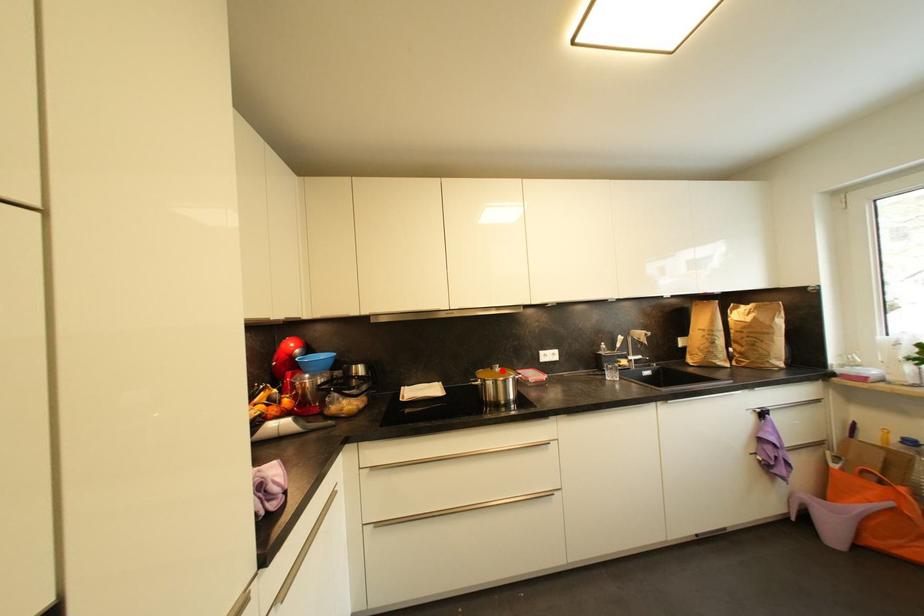
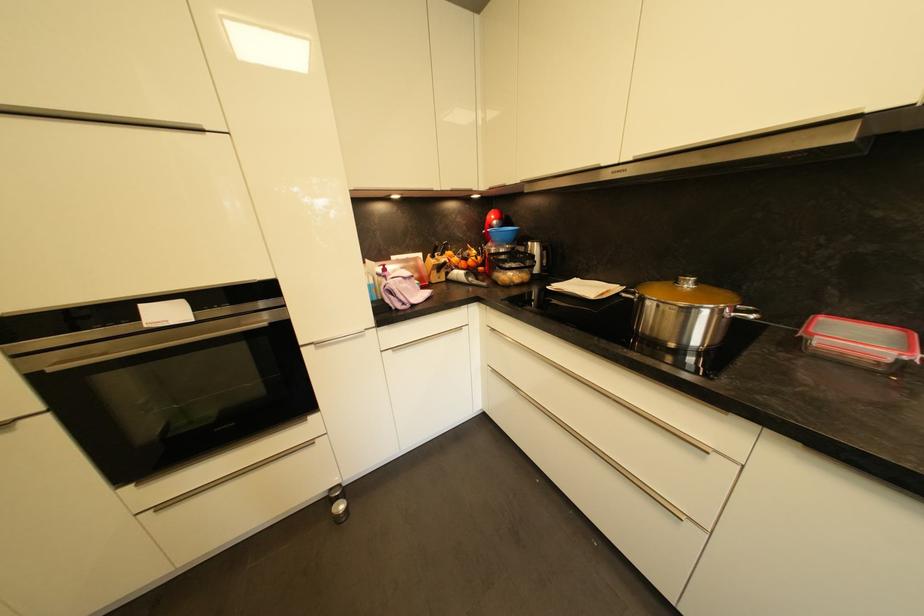
Where in the second image is the point corresponding to the highlighted location from the first image?

(694, 286)